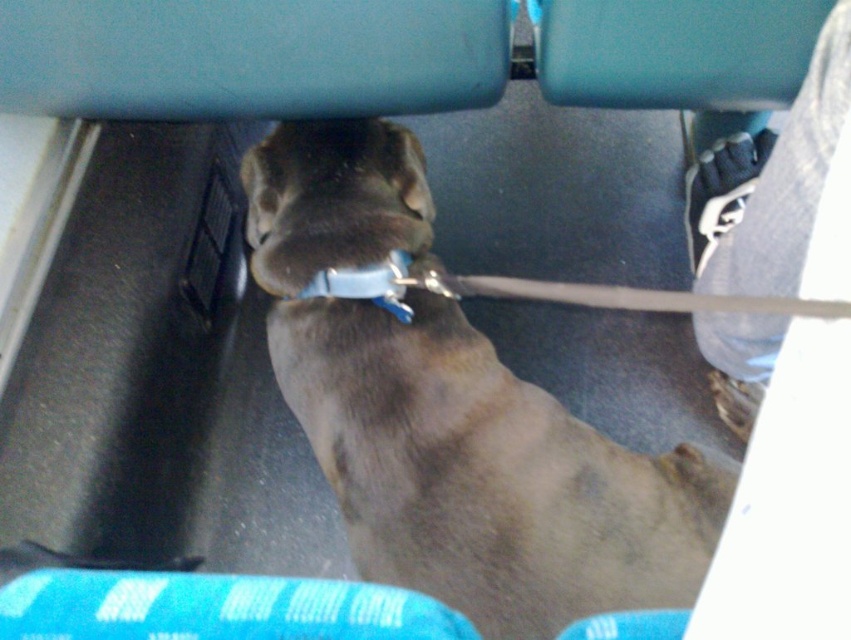
Is brown fur dog at center above blue fabric neckband at center?

No, brown fur dog at center is not above blue fabric neckband at center.

Does brown fur dog at center have a smaller size compared to blue fabric neckband at center?

Actually, brown fur dog at center might be larger than blue fabric neckband at center.

Is point (480, 563) farther from viewer compared to point (408, 260)?

No.

What are the coordinates of `brown fur dog at center` in the screenshot? It's located at (454, 417).

Which is above, blue fabric neckband at center or brown fur nose at center?

brown fur nose at center

Can you confirm if blue fabric neckband at center is positioned to the right of brown fur nose at center?

No, blue fabric neckband at center is not to the right of brown fur nose at center.

Locate an element on the screen. Image resolution: width=851 pixels, height=640 pixels. blue fabric neckband at center is located at coordinates (367, 284).

Can you confirm if brown fur dog at center is wider than brown fur nose at center?

Correct, the width of brown fur dog at center exceeds that of brown fur nose at center.

Which is behind, point (501, 516) or point (421, 216)?

Positioned behind is point (421, 216).

The width and height of the screenshot is (851, 640). I want to click on brown fur dog at center, so [454, 417].